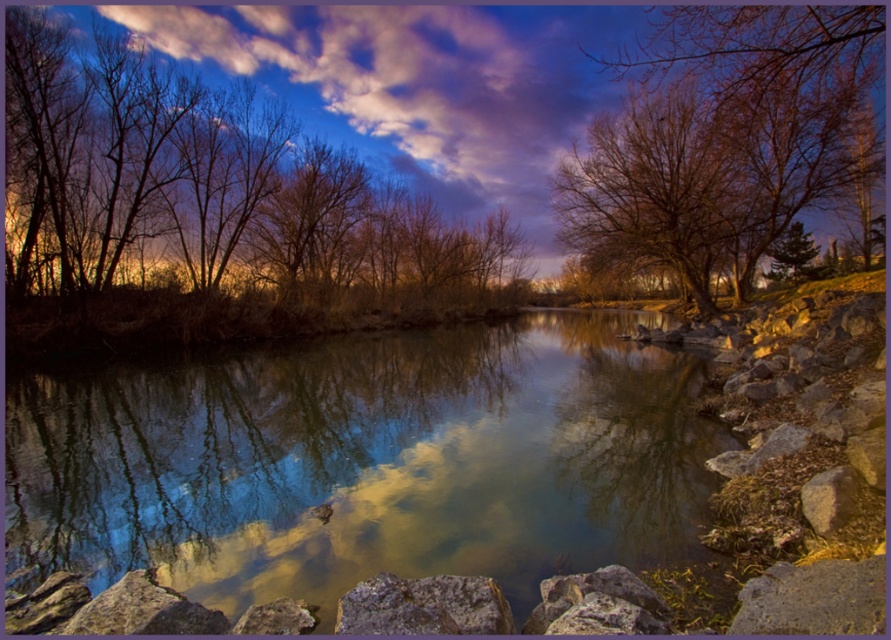
You are standing at the edge of the river and notice two points in the sky above the water. The first point is located at coordinates point (769, 16) and the second at point (844, 480). Which point is closer to you as you face the river?

Point (844, 480) is closer to you because it is in front of point (769, 16).